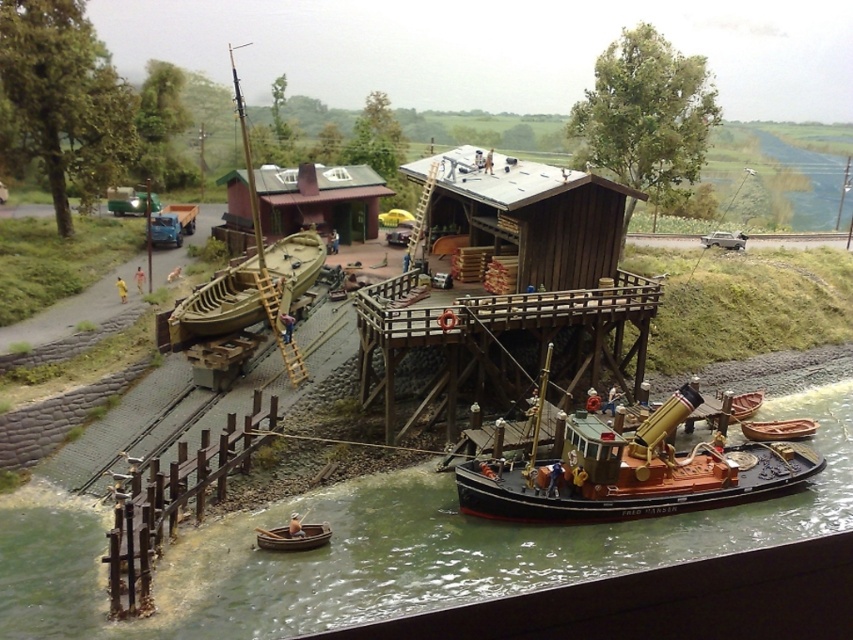
Does greenish water at lower center have a lesser height compared to wooden boat at lower center?

In fact, greenish water at lower center may be taller than wooden boat at lower center.

Is point (48, 586) closer to viewer compared to point (260, 532)?

Yes, it is.

Where is `greenish water at lower center`? greenish water at lower center is located at coordinates (381, 548).

Is wooden polished tugboat at lower right smaller than wooden boat at lower center?

No, wooden polished tugboat at lower right is not smaller than wooden boat at lower center.

Which of these two, wooden polished tugboat at lower right or wooden boat at lower center, stands taller?

With more height is wooden polished tugboat at lower right.

This screenshot has width=853, height=640. In order to click on wooden polished tugboat at lower right in this screenshot , I will do `click(631, 472)`.

In the scene shown: Does wooden boat at center have a lesser width compared to wooden boat at lower right?

No.

The height and width of the screenshot is (640, 853). What are the coordinates of `wooden boat at center` in the screenshot? It's located at (213, 308).